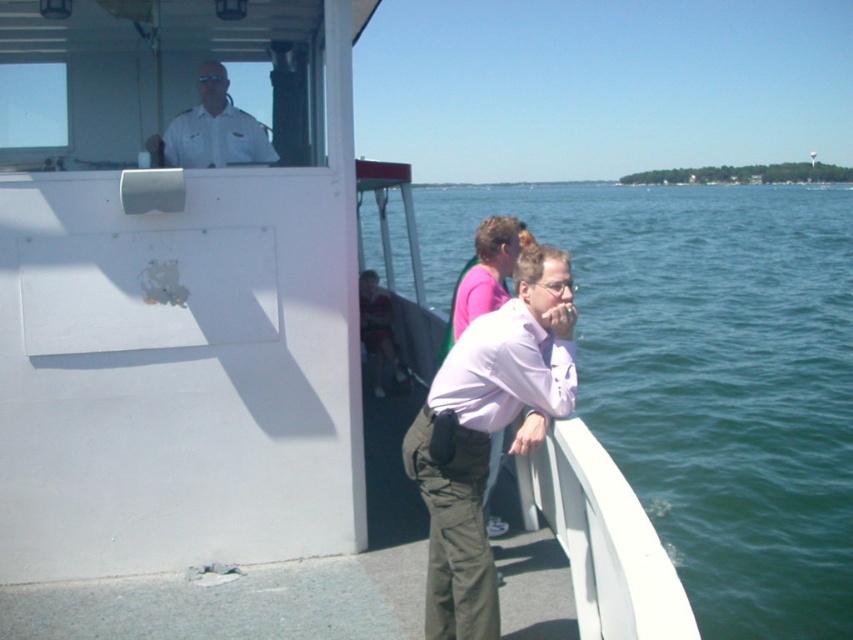
Which is in front, point (254, 118) or point (372, 282)?

Point (254, 118)

Is white uniform at upper center positioned in front of matte black shirt at center?

Yes.

Image resolution: width=853 pixels, height=640 pixels. I want to click on white uniform at upper center, so click(x=212, y=129).

From the picture: Does light purple shirt at center have a lesser height compared to white uniform at upper center?

Incorrect, light purple shirt at center's height does not fall short of white uniform at upper center's.

Does point (515, 300) come farther from viewer compared to point (218, 154)?

No, (515, 300) is closer to viewer.

The image size is (853, 640). What do you see at coordinates (486, 433) in the screenshot?
I see `light purple shirt at center` at bounding box center [486, 433].

Where is `light purple shirt at center`? light purple shirt at center is located at coordinates (486, 433).

Where is `green water at right`? green water at right is located at coordinates (708, 376).

Who is taller, green water at right or white uniform at upper center?

green water at right

Is point (688, 312) less distant than point (213, 102)?

No, it is behind (213, 102).

The image size is (853, 640). Identify the location of green water at right. click(x=708, y=376).